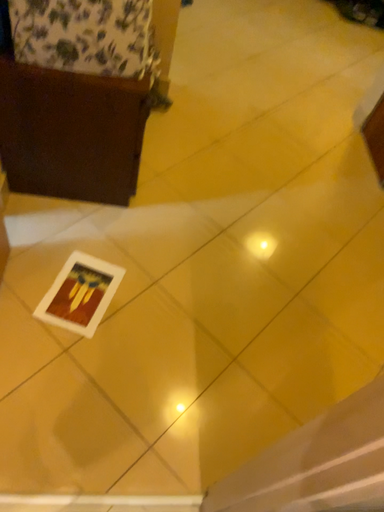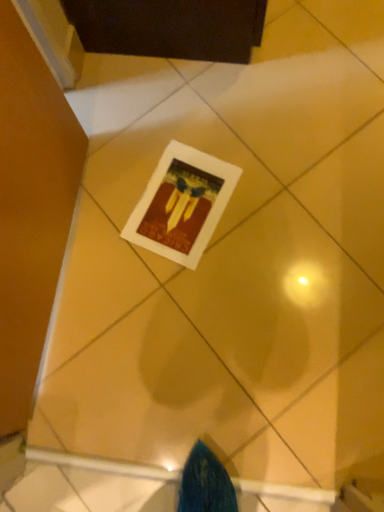
Question: Which way did the camera rotate in the video?

Choices:
 (A) rotated upward
 (B) rotated downward

Answer: (B)